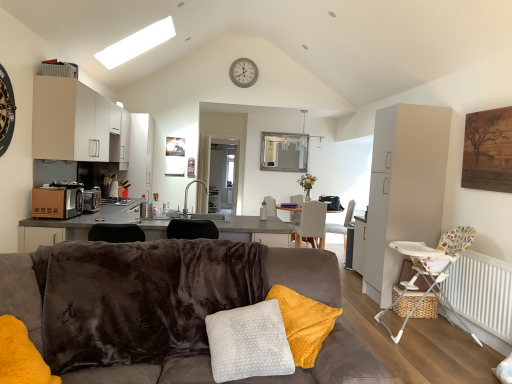
Question: Is light gray fabric chair at center, which ranks as the 1th chair in back-to-front order, further to the viewer compared to white fabric chair at center, which appears as the second chair when viewed from the back?

Choices:
 (A) yes
 (B) no

Answer: (A)

Question: Is light gray fabric chair at center, which ranks as the 1th chair in back-to-front order, positioned with its back to white fabric chair at center, which appears as the second chair when viewed from the back?

Choices:
 (A) no
 (B) yes

Answer: (A)

Question: Can you confirm if light gray fabric chair at center, which ranks as the 1th chair in back-to-front order, is shorter than white fabric chair at center, which appears as the second chair when viewed from the back?

Choices:
 (A) no
 (B) yes

Answer: (A)

Question: Would you consider light gray fabric chair at center, the third chair from the front, to be distant from white fabric chair at center, the 2th chair in the front-to-back sequence?

Choices:
 (A) no
 (B) yes

Answer: (A)

Question: Is light gray fabric chair at center, which ranks as the 1th chair in back-to-front order, wider than white fabric chair at center, which appears as the second chair when viewed from the back?

Choices:
 (A) no
 (B) yes

Answer: (A)

Question: From a real-world perspective, relative to white fabric chair at center, which appears as the second chair when viewed from the back, is silver metallic faucet at center vertically above or below?

Choices:
 (A) above
 (B) below

Answer: (A)

Question: Is silver metallic faucet at center wider or thinner than white fabric chair at center, which appears as the second chair when viewed from the back?

Choices:
 (A) thin
 (B) wide

Answer: (A)

Question: Does point (196, 182) appear closer or farther from the camera than point (317, 210)?

Choices:
 (A) closer
 (B) farther

Answer: (A)

Question: From the image's perspective, relative to white fabric chair at center, the 2th chair in the front-to-back sequence, is silver metallic faucet at center above or below?

Choices:
 (A) below
 (B) above

Answer: (B)

Question: Considering their positions, is velvet brown couch at lower right located in front of or behind matte black toaster at left?

Choices:
 (A) front
 (B) behind

Answer: (A)

Question: Considering the positions of velvet brown couch at lower right and matte black toaster at left in the image, is velvet brown couch at lower right wider or thinner than matte black toaster at left?

Choices:
 (A) wide
 (B) thin

Answer: (A)

Question: Considering the positions of velvet brown couch at lower right and matte black toaster at left in the image, is velvet brown couch at lower right taller or shorter than matte black toaster at left?

Choices:
 (A) short
 (B) tall

Answer: (B)

Question: From the image's perspective, is velvet brown couch at lower right above or below matte black toaster at left?

Choices:
 (A) above
 (B) below

Answer: (B)

Question: Looking at the image, does matte black toaster at left seem bigger or smaller compared to white textured pillow at center?

Choices:
 (A) big
 (B) small

Answer: (B)

Question: From a real-world perspective, relative to white textured pillow at center, is matte black toaster at left vertically above or below?

Choices:
 (A) below
 (B) above

Answer: (B)